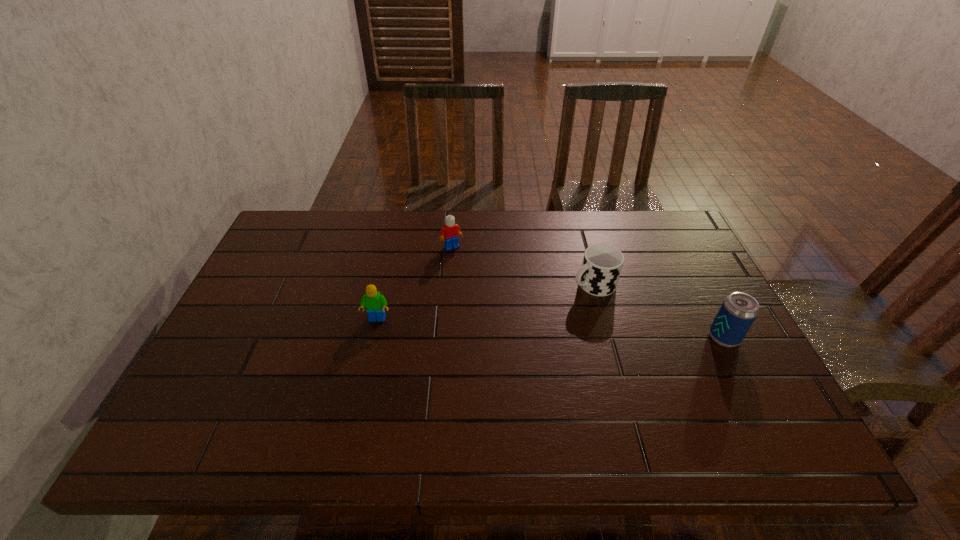
Locate an element on the screen. This screenshot has height=540, width=960. the leftmost object is located at coordinates (374, 302).

Where is `the third farthest object`? the third farthest object is located at coordinates (374, 302).

Where is `beer can`? This screenshot has height=540, width=960. beer can is located at coordinates (738, 311).

This screenshot has height=540, width=960. In order to click on the nearest object in this screenshot , I will do `click(738, 311)`.

The image size is (960, 540). I want to click on the farther Lego, so coord(449,234).

Find the location of a particular element. the farthest object is located at coordinates (449, 234).

The height and width of the screenshot is (540, 960). Find the location of `cup`. cup is located at coordinates (602, 263).

The height and width of the screenshot is (540, 960). Find the location of `the second farthest object`. the second farthest object is located at coordinates (602, 263).

Where is `vacant space situated on the face of the third farthest object`? vacant space situated on the face of the third farthest object is located at coordinates (368, 362).

Find the location of `vacant space positioned 0.220m on the back of the nearest object`. vacant space positioned 0.220m on the back of the nearest object is located at coordinates (688, 269).